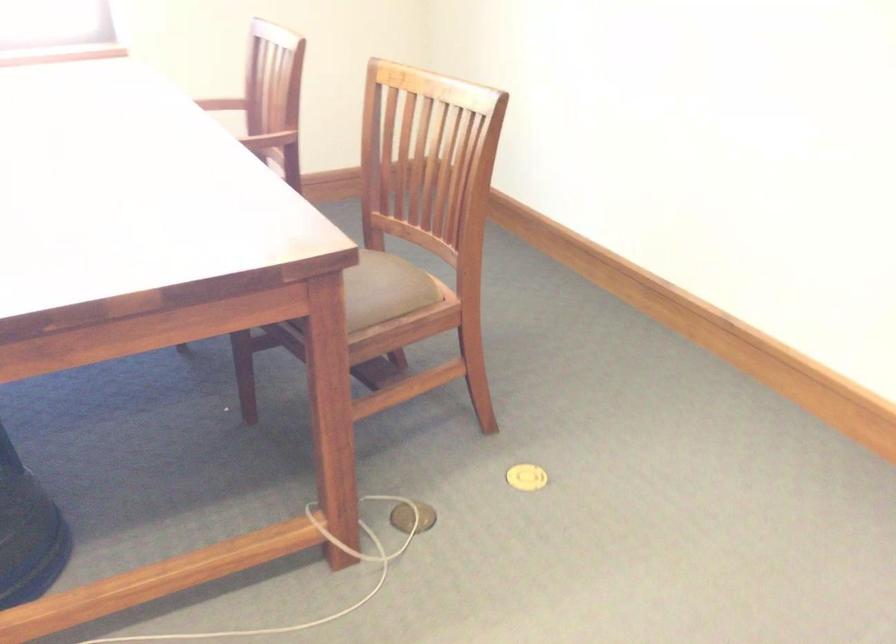
The image size is (896, 644). Identify the location of chair armrest. (268, 138).